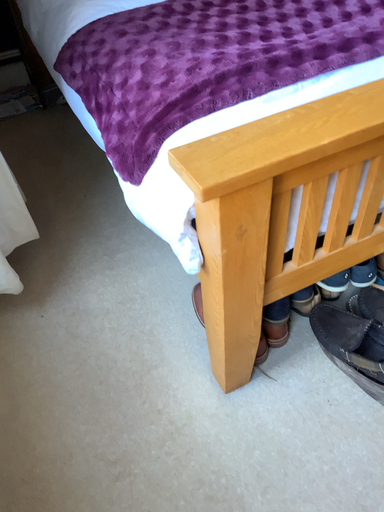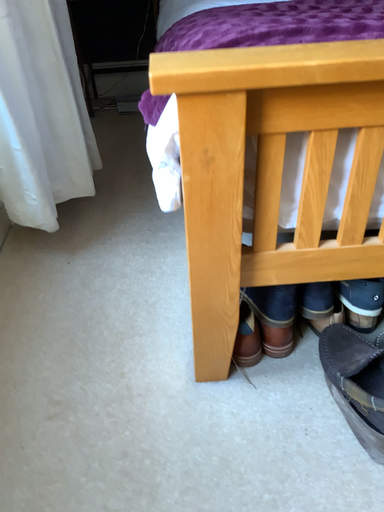
Question: Which way did the camera rotate in the video?

Choices:
 (A) rotated left
 (B) rotated right

Answer: (A)